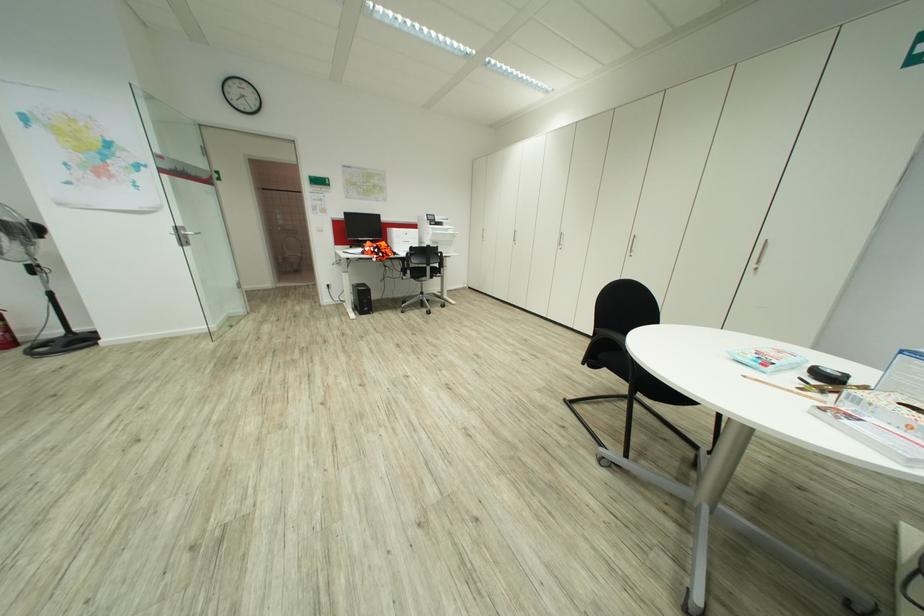
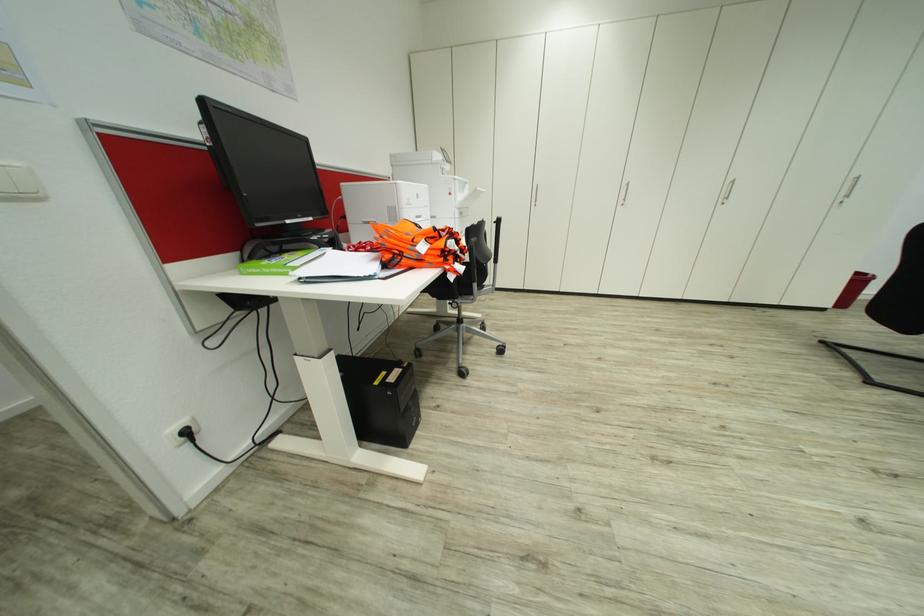
Where in the second image is the point corresponding to [326,285] from the first image?

(186, 432)